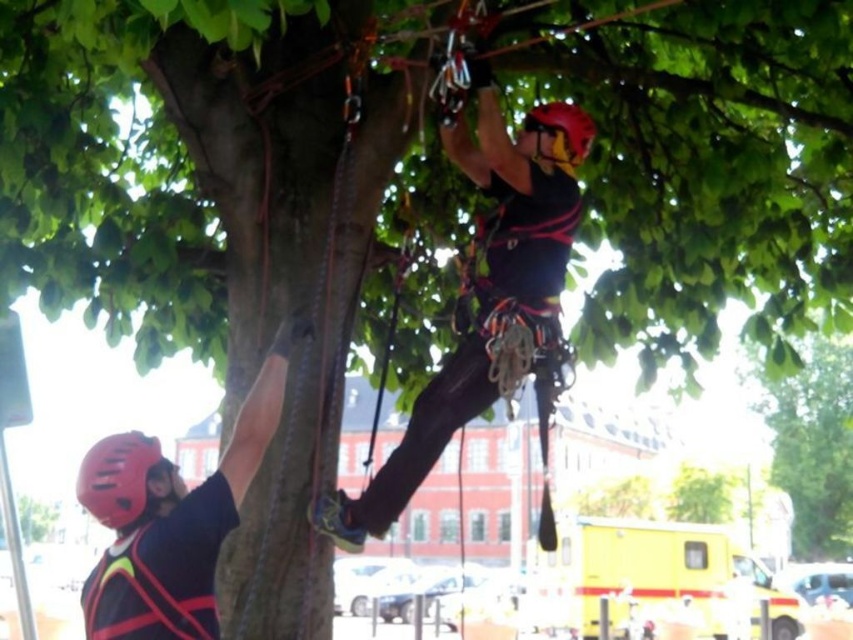
Based on the photo, you are a safety inspector observing two climbers in the scene. You need to determine if the climber with the matte black helmet at left is positioned higher than the climber with the matte black helmet at lower left. Can you confirm this based on the scene?

The matte black helmet at left is located above the matte black helmet at lower left, so yes, the climber with the matte black helmet at left is positioned higher than the climber with the matte black helmet at lower left.

You are a tree climber trying to reach the highest point of the tree. The point you want to reach is marked as point (813, 445). Which direction should you go from your current position at the base of the tree?

The point (813, 445) is on the green leafy tree at upper center, so you should climb upward towards the upper center of the tree to reach it.